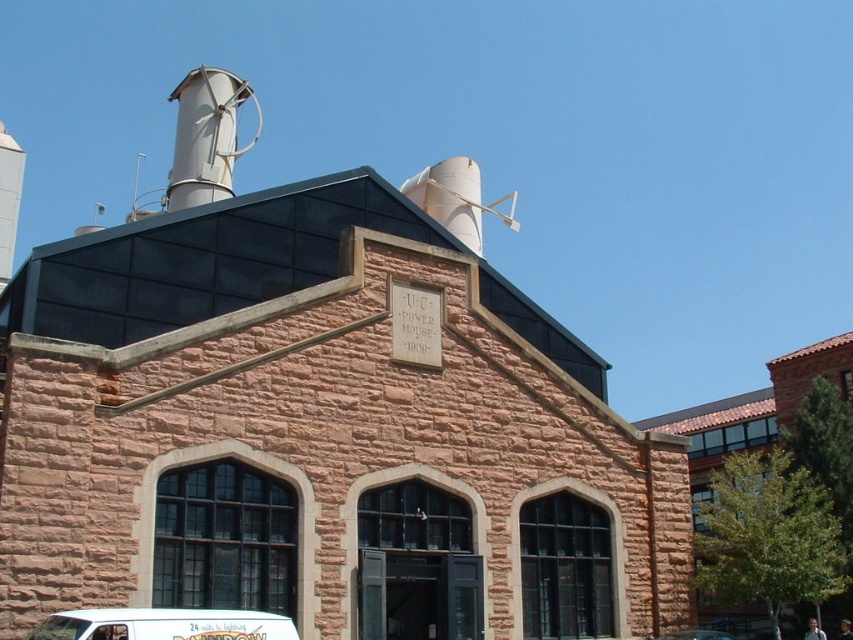
Is metallic silver chimney at upper left to the right of white matte van at center from the viewer's perspective?

Incorrect, metallic silver chimney at upper left is not on the right side of white matte van at center.

Is point (167, 209) more distant than point (717, 637)?

That is True.

Locate an element on the screen. The width and height of the screenshot is (853, 640). metallic silver chimney at upper left is located at coordinates pos(206,136).

Between white matte van at lower center and white matte van at center, which one is positioned higher?

white matte van at lower center is higher up.

Measure the distance between white matte van at lower center and white matte van at center.

19.10 meters

Measure the distance between point (151,637) and camera.

The distance of point (151,637) from camera is 24.88 meters.

Image resolution: width=853 pixels, height=640 pixels. Find the location of `white matte van at lower center`. white matte van at lower center is located at coordinates (164, 625).

Is metallic silver chimney at upper left smaller than white matte van at lower center?

No, metallic silver chimney at upper left is not smaller than white matte van at lower center.

Which is in front, point (242, 81) or point (61, 614)?

Positioned in front is point (61, 614).

Between point (210, 76) and point (189, 609), which one is positioned behind?

Point (210, 76)

This screenshot has width=853, height=640. I want to click on metallic silver chimney at upper left, so click(x=206, y=136).